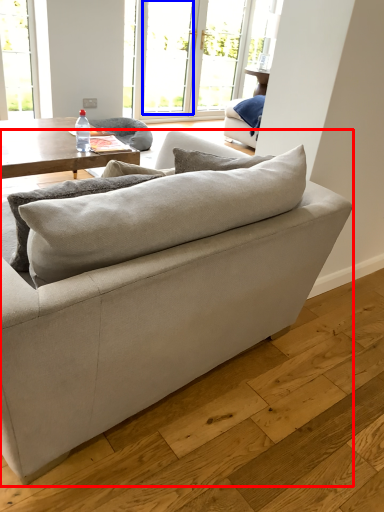
Question: Which object is further to the camera taking this photo, studio couch (highlighted by a red box) or window (highlighted by a blue box)?

Choices:
 (A) studio couch
 (B) window

Answer: (B)